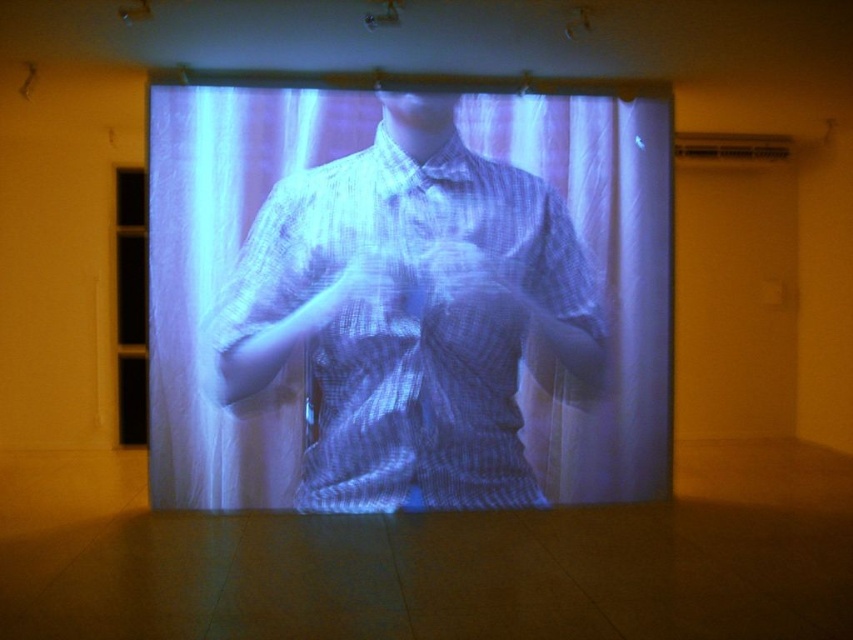
You are an art curator examining the projection of the person in the checkered shirt. You notice two translucent elements at the center of the projection. Which one is wider, the translucent white shirt at center or the translucent fabric hand at center?

The translucent white shirt at center might be wider than the translucent fabric hand at center.

You are an art curator planning to add a new element to the installation. You want to place a small decorative item between the translucent white shirt at center and the translucent fabric hand at center. Considering their sizes, which object should the item be placed closer to?

The translucent white shirt at center is much taller than the translucent fabric hand at center, so the item should be placed closer to the translucent fabric hand at center to maintain balance.

You are an art curator examining the projection in the gallery. You notice the translucent white shirt at center and the translucent fabric hand at center. Which object is positioned to the right in the projection?

The translucent white shirt at center is positioned to the right of the translucent fabric hand at center.